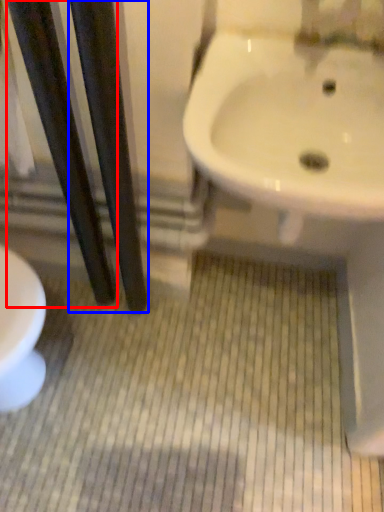
Question: Which of the following is the farthest to the observer, pole (highlighted by a red box) or pole (highlighted by a blue box)?

Choices:
 (A) pole
 (B) pole

Answer: (A)